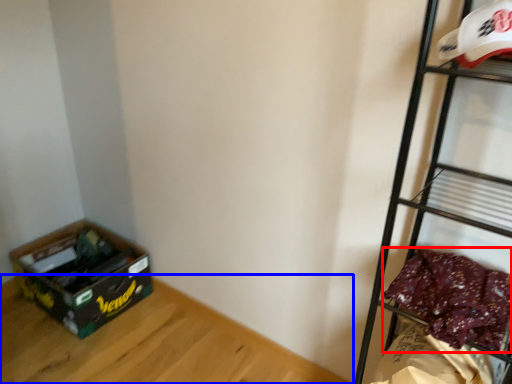
Question: Which object appears closest to the camera in this image, clothing (highlighted by a red box) or furniture (highlighted by a blue box)?

Choices:
 (A) clothing
 (B) furniture

Answer: (A)